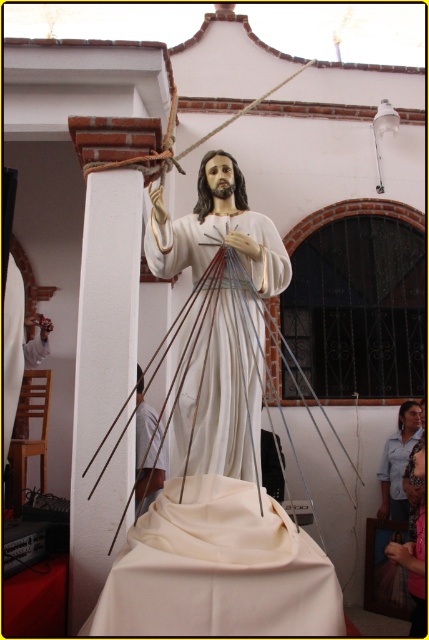
You are an interior designer planning to place a new decorative item in the church. The item requires a surface wider than the white fabric at lower center. Based on the scene, can the white glossy statue at center provide enough space for this item?

The white glossy statue at center is wider than the white fabric at lower center. Since the statue is wider, it can provide sufficient space for the decorative item requiring a surface wider than the white fabric at lower center.

You are an art conservator examining the religious scene. You need to determine the best way to clean the white glossy statue at center and the white fabric at lower center. Since they are both white, what detail should you consider to ensure proper cleaning?

The white glossy statue at center is in front of the white fabric at lower center, so you should clean the fabric first to avoid splashing cleaner onto the statue which is closer to you.

You are standing in a church and want to get a closer look at the white glossy statue at center. If you take three steps forward, each step being 2.5 feet long, will you be within 5 feet of the statue?

The white glossy statue at center is 12.24 feet away from viewer. After taking three steps forward, each 2.5 feet, you move 7.5 feet closer. Subtracting this from the initial distance, 12.24 minus 7.5 equals 4.74 feet. Since 4.74 is less than 5, you will be within 5 feet of the statue.